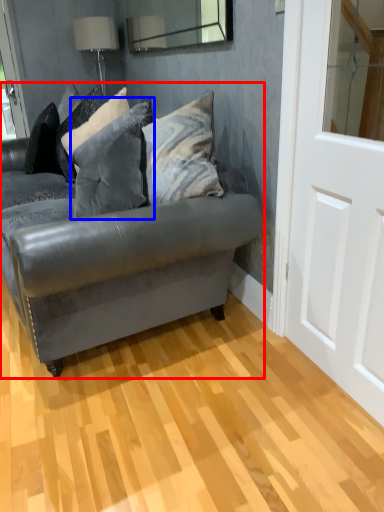
Question: Which object is further to the camera taking this photo, studio couch (highlighted by a red box) or pillow (highlighted by a blue box)?

Choices:
 (A) studio couch
 (B) pillow

Answer: (B)